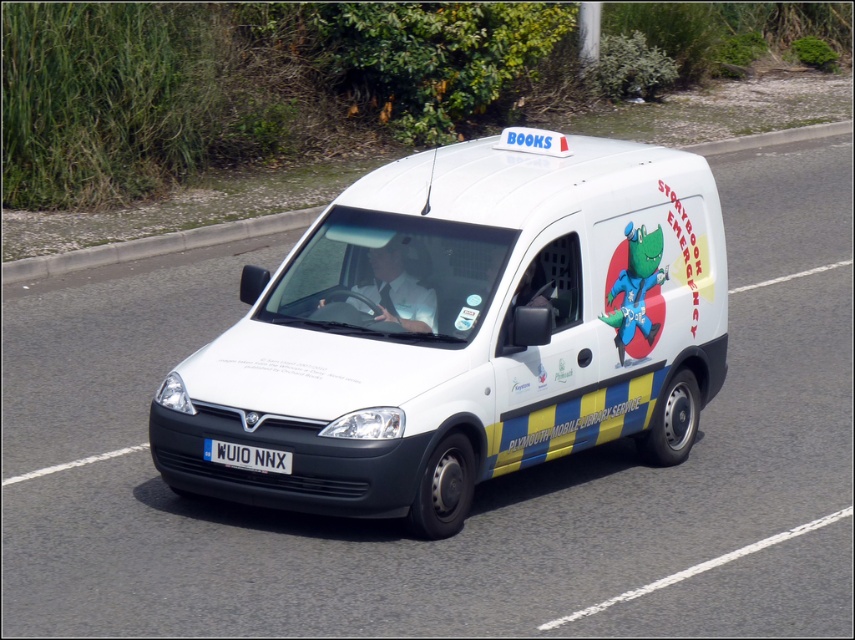
Question: Is the position of white matte van at center more distant than that of white plastic license plate at center?

Choices:
 (A) no
 (B) yes

Answer: (A)

Question: Among these points, which one is farthest from the camera?

Choices:
 (A) (248, 468)
 (B) (628, 144)

Answer: (B)

Question: Observing the image, what is the correct spatial positioning of white matte van at center in reference to white plastic license plate at center?

Choices:
 (A) above
 (B) below

Answer: (A)

Question: Is white matte van at center in front of white plastic license plate at center?

Choices:
 (A) yes
 (B) no

Answer: (A)